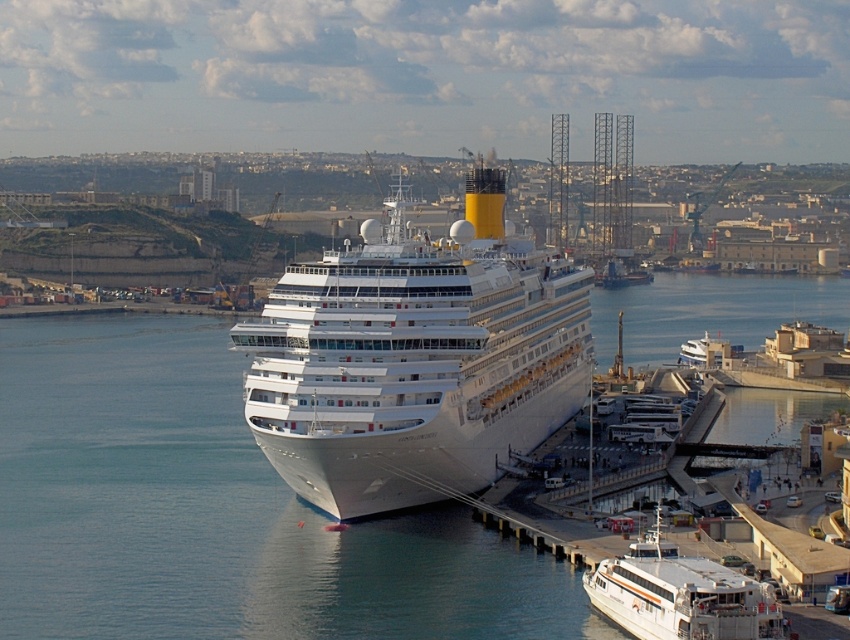
Based on the photo, you are a passenger on the cruise ship and want to take a photo of the white glossy ferry at lower right. However, you are standing on the upper deck near the yellow and black funnel. Will the clear blue water at center block your view of the ferry?

The clear blue water at center is positioned over the white glossy ferry at lower right, so it will block your view of the ferry.

You are standing on the dock and looking at the clear blue water at center and the white glossy cruise ship at center. Which object is located higher in the image?

The clear blue water at center is above the white glossy cruise ship at center, so the clear blue water at center is higher in the image.